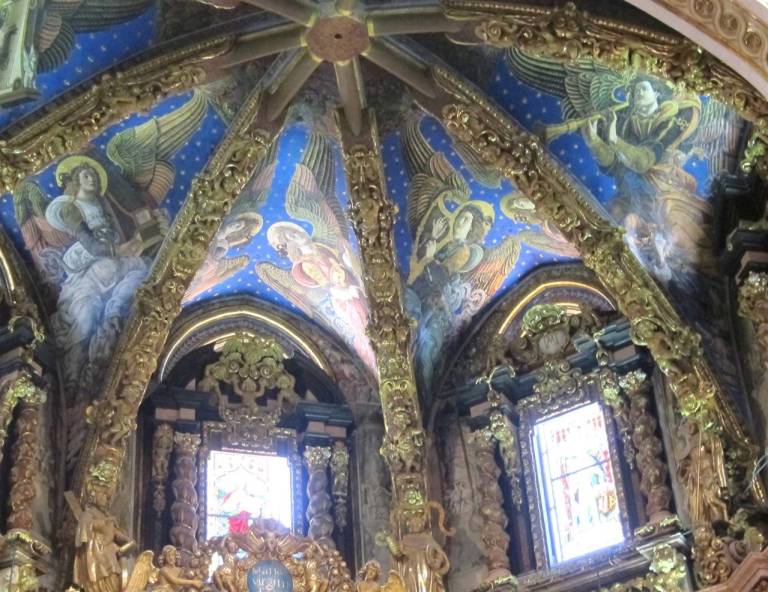
This screenshot has height=592, width=768. Find the location of `ceiling`. ceiling is located at coordinates (467, 197).